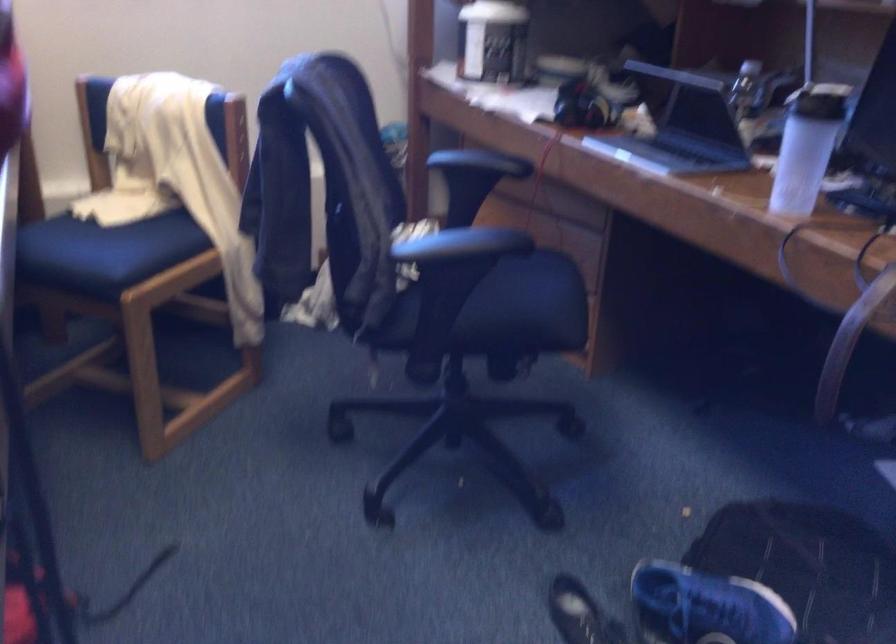
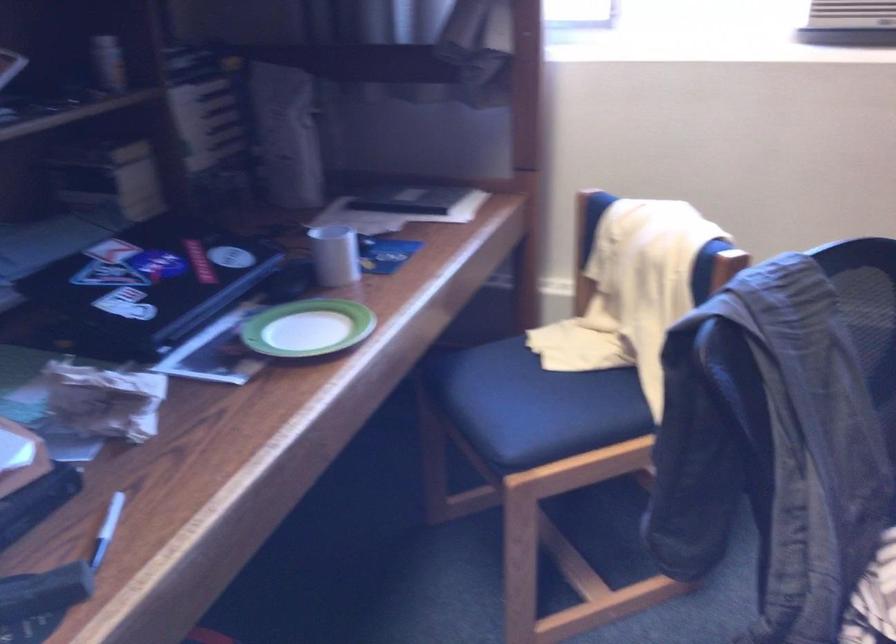
In the second image, find the point that corresponds to [242,111] in the first image.

(728, 263)